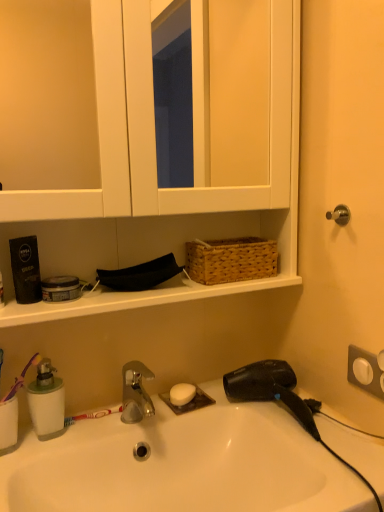
At what (x,y) coordinates should I click in order to perform the action: click on free space to the right of green translucent soap dispenser at lower left. Please return your answer as a coordinate pair (x, y). This screenshot has width=384, height=512. Looking at the image, I should click on (105, 429).